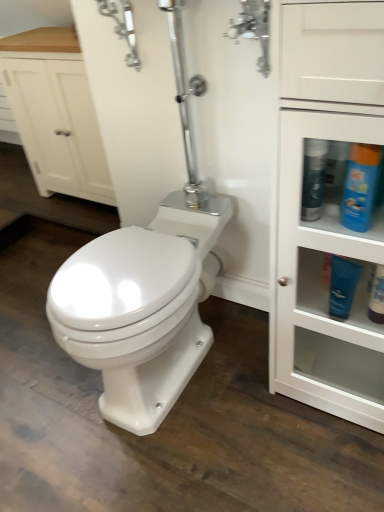
The width and height of the screenshot is (384, 512). What are the coordinates of `free location to the left of white glossy cabinet at right` in the screenshot? It's located at (242, 407).